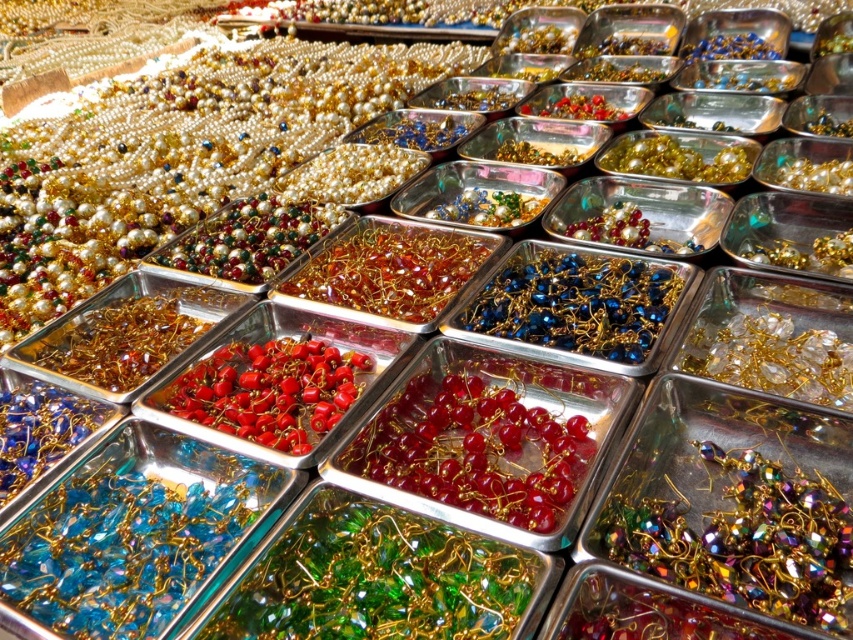
Based on the photo, you are a customer at a bead store and want to buy the blue metallic beads at center and the translucent amber beads at center. When looking at the display, which of these two beads appears closer to you?

The blue metallic beads at center appears closer to you because they are in front of the translucent amber beads at center.

You are standing in front of a bead display and want to pick up two points marked in the scene. The first point is at coordinates point (602, 531) and the second is at point (421, 321). Which point is closer to you?

Point (602, 531) is closer to the viewer than point (421, 321).

You are a jeweler trying to create a necklace that requires beads with a certain width. You have two options from the display shown in the image. The first option is the glossy red beads at center, and the second option is the translucent red beads at center. Which of these beads do you think has a larger width?

The glossy red beads at center might be wider than translucent red beads at center, so the glossy red beads at center could be the better choice for the necklace if a wider bead is needed.